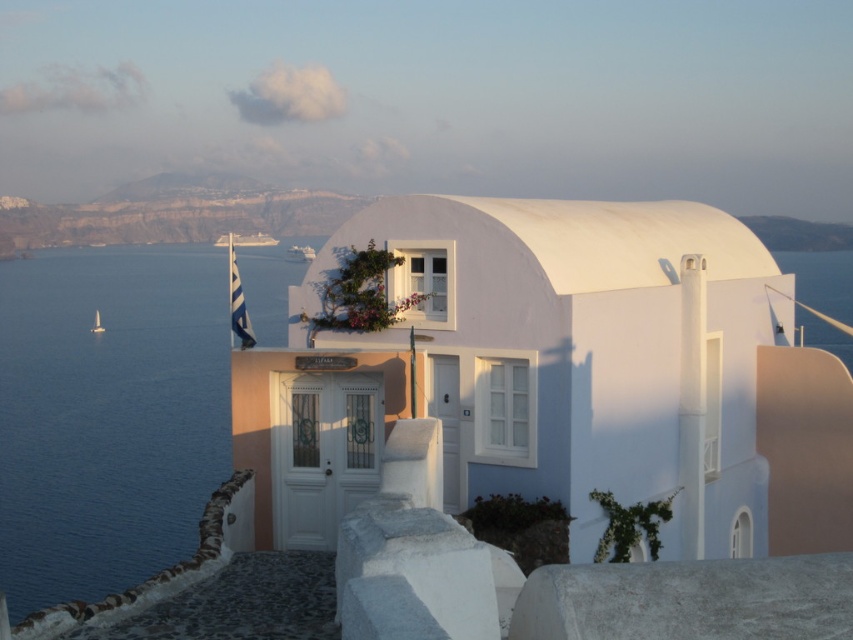
You are standing at the base of the hill where the white matte building at center is located. You want to take a photo that captures the entire building in the frame. Considering the camera you have can focus clearly up to 60 feet away, will you need to move closer or farther away to ensure the building is in focus?

The white matte building at center is 63.80 feet away from the camera. Since your camera can focus clearly up to 60 feet, you need to move closer to ensure the building is within the focus range.

You are standing at the base of the flagpole with the blue and white striped flag to your left. You want to walk directly to the white matte building at center. Which direction should you head towards?

You should head towards the direction of the white matte building at center, which is located at coordinates point (x=560, y=376).